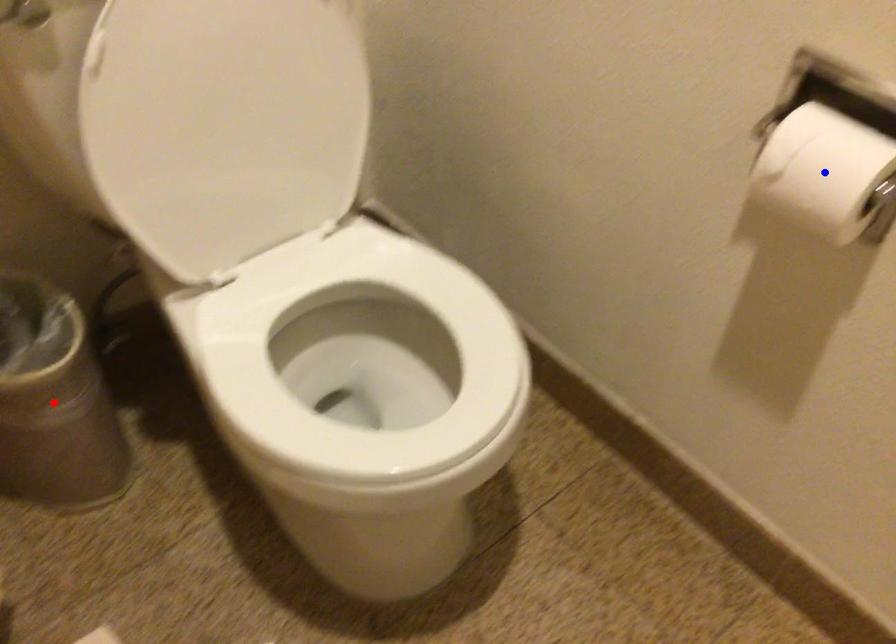
Question: Which of the two points in the image is closer to the camera?

Choices:
 (A) Blue point is closer.
 (B) Red point is closer.

Answer: (A)